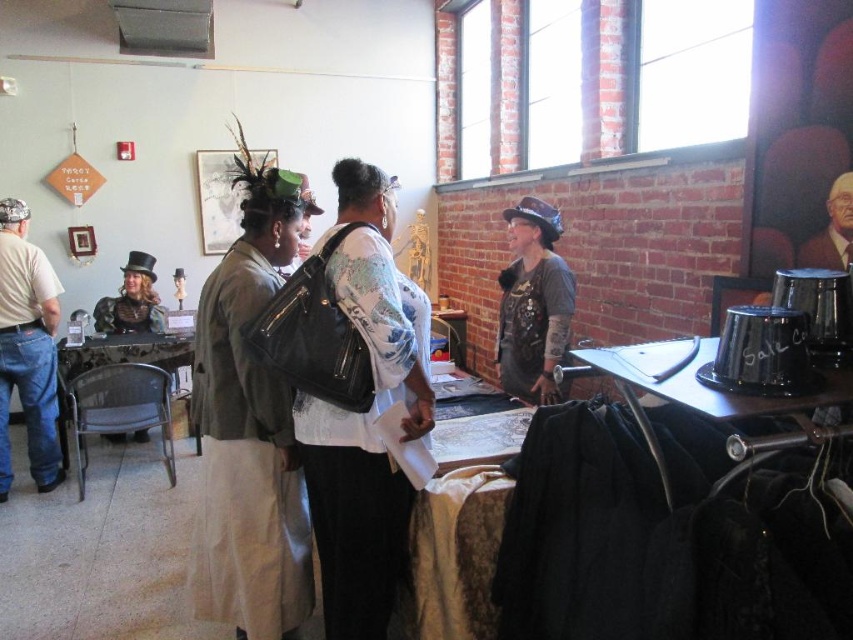
Does point (258, 499) come behind point (846, 180)?

Yes, it is behind point (846, 180).

Between matte black purse at center and smooth black hat at upper right, which one has more height?

Standing taller between the two is matte black purse at center.

The height and width of the screenshot is (640, 853). I want to click on matte black purse at center, so click(x=250, y=428).

Does denim jeans at left have a lesser height compared to steampunk-style hat at center?

Incorrect, denim jeans at left's height does not fall short of steampunk-style hat at center's.

What are the coordinates of `denim jeans at left` in the screenshot? It's located at (27, 348).

Where is `denim jeans at left`? denim jeans at left is located at coordinates (27, 348).

Which of these two, matte black purse at center or steampunk-style hat at center, stands taller?

With more height is matte black purse at center.

Does point (236, 412) come behind point (538, 198)?

No, it is in front of (538, 198).

Find the location of `matte black purse at center`. matte black purse at center is located at coordinates (250, 428).